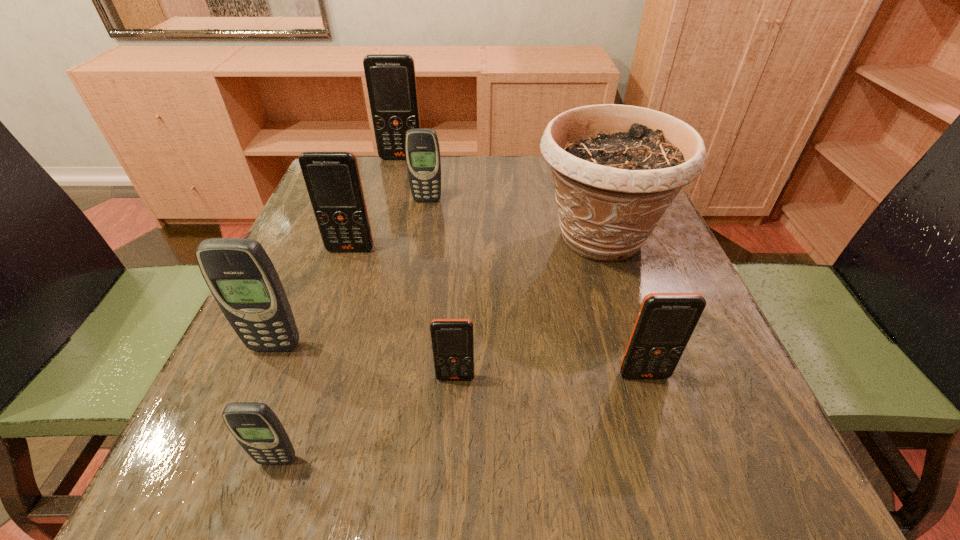
The width and height of the screenshot is (960, 540). I want to click on free space located on the screen of the second smallest orange cellular telephone, so click(657, 416).

At what (x,y) coordinates should I click in order to perform the action: click on blank space located 0.130m on the screen of the sixth object from left to right. Please return your answer as a coordinate pair (x, y). The image size is (960, 540). Looking at the image, I should click on (451, 464).

Where is `flowerpot located in the far edge section of the desktop`? Image resolution: width=960 pixels, height=540 pixels. flowerpot located in the far edge section of the desktop is located at coordinates (616, 168).

Identify the location of object that is at the near edge. pyautogui.click(x=255, y=426).

Where is `flowerpot positioned at the right edge`? This screenshot has height=540, width=960. flowerpot positioned at the right edge is located at coordinates (616, 168).

Identify the location of cellular telephone that is positioned at the right edge. This screenshot has height=540, width=960. (665, 322).

The width and height of the screenshot is (960, 540). Find the location of `object located in the far left corner section of the desktop`. object located in the far left corner section of the desktop is located at coordinates (391, 80).

Locate an element on the screen. The image size is (960, 540). object that is at the near left corner is located at coordinates (255, 426).

The width and height of the screenshot is (960, 540). What are the coordinates of `object that is at the far right corner` in the screenshot? It's located at (616, 168).

The image size is (960, 540). In the image, there is a desktop. In order to click on vacant space at the far edge in this screenshot , I will do `click(519, 186)`.